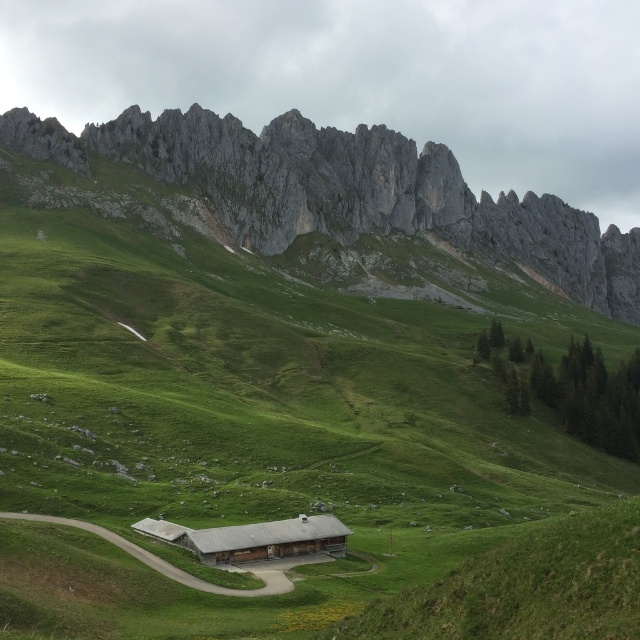
You are standing at the bottom of the hill and want to reach the brown wooden barn at center. The path is narrow and you need to know if the green grassy area at center is in your way. Can you tell me if the green grassy at center is blocking your path to the barn?

The green grassy at center is above the brown wooden barn at center, so it is located higher up and not directly blocking your path to the barn. You can proceed along the path without obstruction from the grassy area.